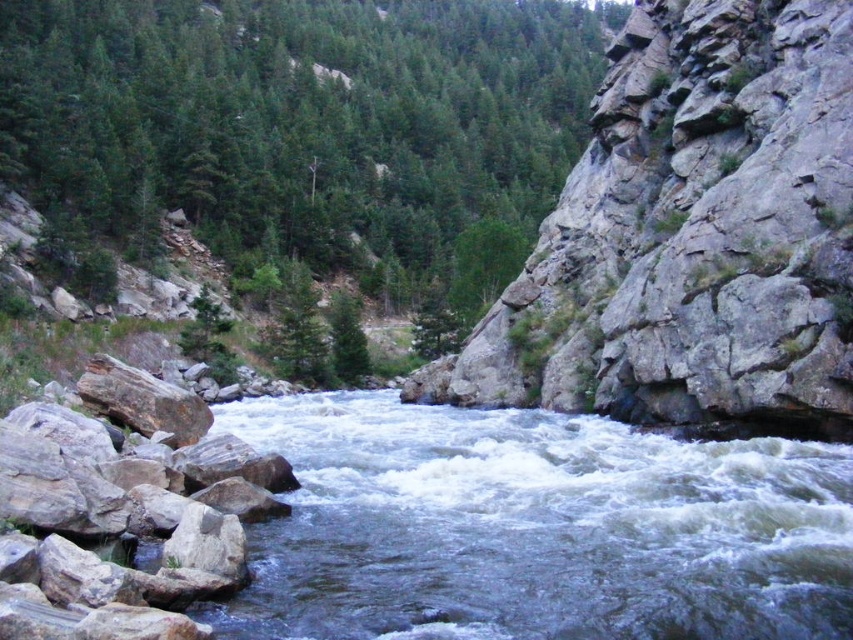
Who is more distant from viewer, (119, 13) or (788, 570)?

The point (119, 13) is more distant.

What are the coordinates of `green matte tree at upper center` in the screenshot? It's located at (300, 131).

Is green matte tree at upper center bigger than gray rough rock at lower left?

Indeed, green matte tree at upper center has a larger size compared to gray rough rock at lower left.

From the picture: Does green matte tree at upper center have a lesser width compared to gray rough rock at lower left?

No, green matte tree at upper center is not thinner than gray rough rock at lower left.

The width and height of the screenshot is (853, 640). What do you see at coordinates (300, 131) in the screenshot?
I see `green matte tree at upper center` at bounding box center [300, 131].

The height and width of the screenshot is (640, 853). In order to click on green matte tree at upper center in this screenshot , I will do `click(300, 131)`.

Describe the element at coordinates (537, 529) in the screenshot. I see `clear water at center` at that location.

Measure the distance between clear water at center and camera.

The distance of clear water at center from camera is 8.16 meters.

Where is `clear water at center`? The height and width of the screenshot is (640, 853). clear water at center is located at coordinates coord(537,529).